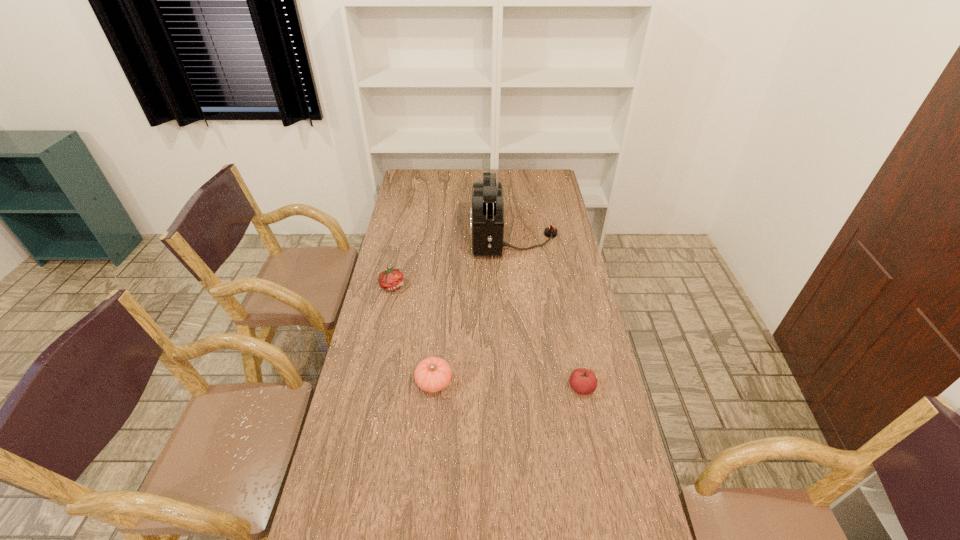
Identify the location of radio receiver. (487, 212).

At what (x,y) coordinates should I click in order to perform the action: click on the tallest object. Please return your answer as a coordinate pair (x, y). Looking at the image, I should click on (487, 212).

At what (x,y) coordinates should I click in order to perform the action: click on the second tomato from left to right. Please return your answer as a coordinate pair (x, y). Looking at the image, I should click on pyautogui.click(x=433, y=374).

Where is `the rightmost tomato`? the rightmost tomato is located at coordinates (583, 381).

This screenshot has height=540, width=960. I want to click on the second farthest object, so click(391, 279).

Image resolution: width=960 pixels, height=540 pixels. I want to click on the leftmost tomato, so click(x=391, y=279).

Find the location of a particular element. This screenshot has width=960, height=540. vacant area located 0.270m on the front-facing side of the tallest object is located at coordinates (411, 236).

Find the location of a particular element. The image size is (960, 540). free region located 0.120m on the front-facing side of the tallest object is located at coordinates (x=444, y=236).

Locate an element on the screen. This screenshot has width=960, height=540. vacant space located 0.360m on the front-facing side of the tallest object is located at coordinates (392, 236).

This screenshot has width=960, height=540. Identify the location of vacant space located 0.290m on the back of the third object from right to left. (441, 305).